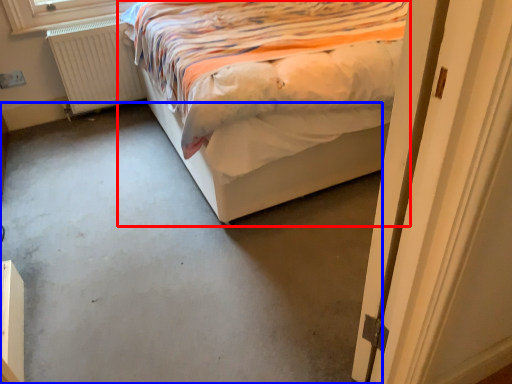
Question: Which point is further to the camera, bed (highlighted by a red box) or concrete (highlighted by a blue box)?

Choices:
 (A) bed
 (B) concrete

Answer: (A)